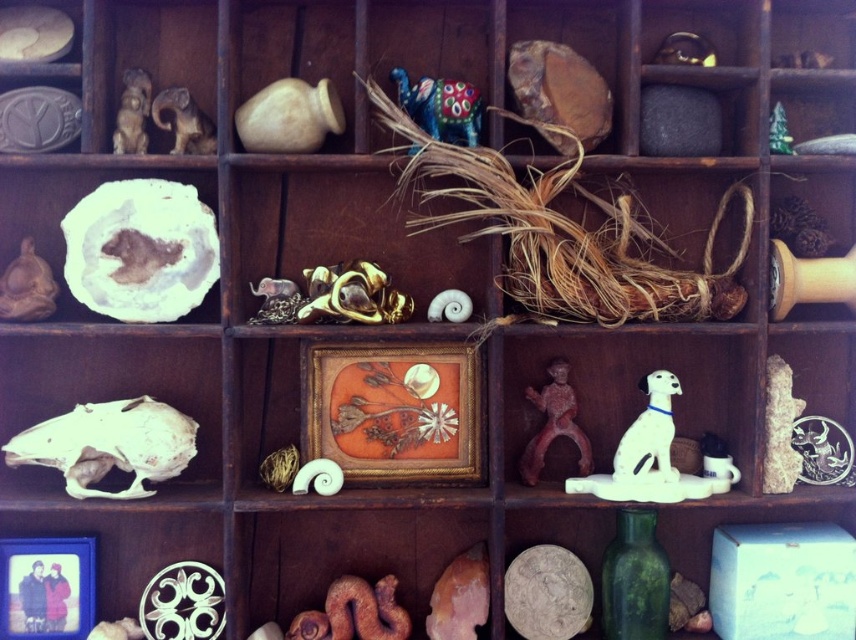
You are organizing a display in the wooden shelving unit. You need to place a new item between the white ceramic dog at center right and the matte brown figurine at upper left. Based on their positions, where should you place the new item?

The new item should be placed between the white ceramic dog at center right and the matte brown figurine at upper left, positioned above the white ceramic dog at center right since it is below the matte brown figurine at upper left.

You are an interior designer planning to rearrange the items on the wooden shelving unit. You want to place the white glossy dog at center right next to the matte brown figurine at upper left. Based on their widths, is this feasible?

The white glossy dog at center right might be wider than the matte brown figurine at upper left, so it is uncertain if they can fit side by side without overlapping. Check their exact dimensions for confirmation.

You are an interior designer arranging items on a shelf. You have a gold textured picture frame at center and a gold metallic sculpture at center. The shelf has a width of 12 centimeters. Can both items fit side by side without overlapping?

The gold textured picture frame at center is 12.11 centimeters from gold metallic sculpture at center, which means there is only 12.11 cm between them. Since the shelf is only 12 cm wide, the two items cannot fit side by side without overlapping as they require slightly more space than available.